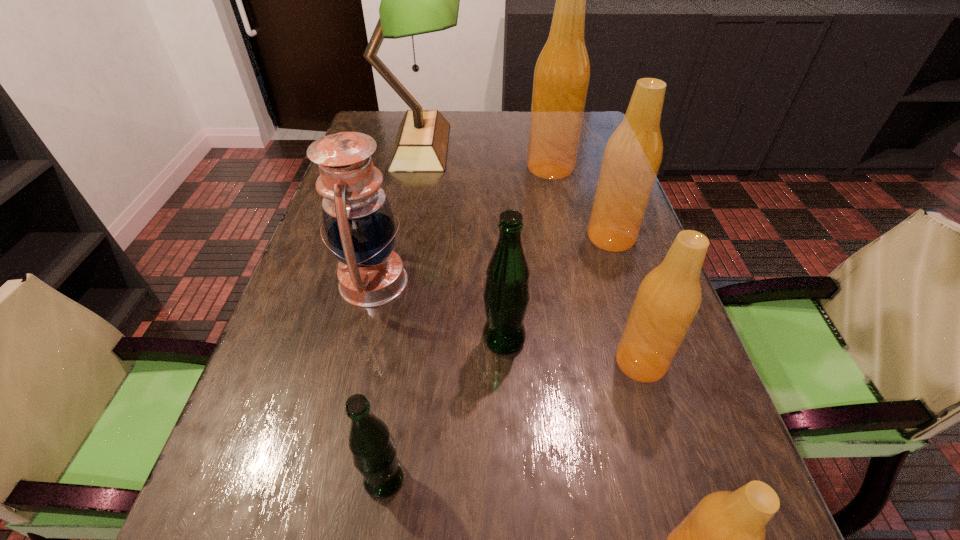
Where is `the smaller green beer bottle`? The image size is (960, 540). the smaller green beer bottle is located at coordinates tap(373, 449).

I want to click on vacant space located 0.330m on the metallic stand of the green table lamp, so click(x=567, y=146).

Find the location of a particular element. vacant space located on the left of the biggest tan beer bottle is located at coordinates tap(395, 167).

At what (x,y) coordinates should I click in order to perform the action: click on vacant space located on the front of the third nearest tan beer bottle. Please return your answer as a coordinate pair (x, y). This screenshot has width=960, height=540. Looking at the image, I should click on (632, 301).

Identify the location of vacant space located 0.390m on the front of the blue oil lamp. coord(314,531).

At what (x,y) coordinates should I click in order to perform the action: click on vacant area situated 0.310m on the back of the third biggest tan beer bottle. Please return your answer as a coordinate pair (x, y). The image size is (960, 540). Looking at the image, I should click on (603, 239).

In order to click on vacant space located on the left of the bigger green beer bottle in this screenshot , I will do `click(396, 340)`.

This screenshot has width=960, height=540. Identify the location of vacant space located on the back of the seventh farthest object. coord(394,417).

The height and width of the screenshot is (540, 960). I want to click on object located in the far edge section of the desktop, so click(x=415, y=0).

Find the location of a particular element. This screenshot has width=960, height=540. table lamp that is at the left edge is located at coordinates (415, 0).